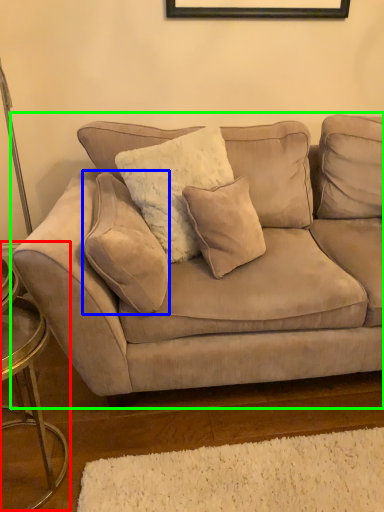
Question: Estimate the real-world distances between objects in this image. Which object is closer to side table (highlighted by a red box), pillow (highlighted by a blue box) or studio couch (highlighted by a green box)?

Choices:
 (A) pillow
 (B) studio couch

Answer: (A)